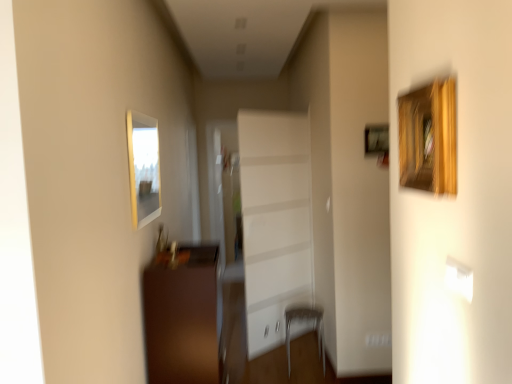
Question: Is point (146, 367) positioned closer to the camera than point (304, 304)?

Choices:
 (A) farther
 (B) closer

Answer: (B)

Question: Relative to metallic silver armchair at lower center, is brown wooden cabinet at lower left in front or behind?

Choices:
 (A) behind
 (B) front

Answer: (B)

Question: Which object is the farthest from the matte wooden picture frame at upper left?

Choices:
 (A) white glossy cabinet at center
 (B) metallic silver armchair at lower center
 (C) brown wooden cabinet at lower left

Answer: (B)

Question: Estimate the real-world distances between objects in this image. Which object is closer to the matte wooden picture frame at upper left?

Choices:
 (A) white glossy cabinet at center
 (B) brown wooden cabinet at lower left
 (C) metallic silver armchair at lower center

Answer: (B)